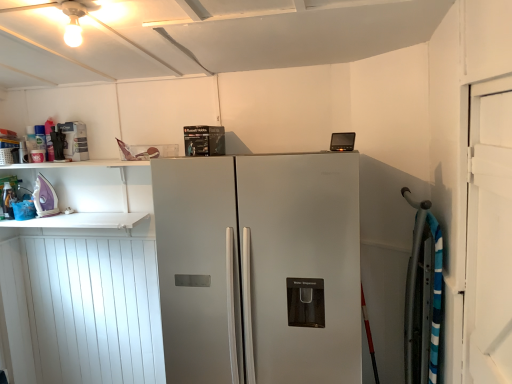
Question: Is point (260, 380) closer or farther from the camera than point (53, 205)?

Choices:
 (A) closer
 (B) farther

Answer: (A)

Question: In terms of size, does satin silver refrigerator at center appear bigger or smaller than purple glossy iron at left, which is the 1th appliance from left to right?

Choices:
 (A) big
 (B) small

Answer: (A)

Question: Which of these objects is positioned closest to the purple glossy iron at left, which is the 2th appliance from top to bottom?

Choices:
 (A) matte white spray can at upper left, placed as the 1th appliance when sorted from right to left
 (B) satin silver refrigerator at center
 (C) white wood door at right

Answer: (A)

Question: Estimate the real-world distances between objects in this image. Which object is farther from the satin silver refrigerator at center?

Choices:
 (A) purple glossy iron at left, acting as the second appliance starting from the right
 (B) matte white spray can at upper left, placed as the 1th appliance when sorted from right to left
 (C) white wood door at right

Answer: (A)